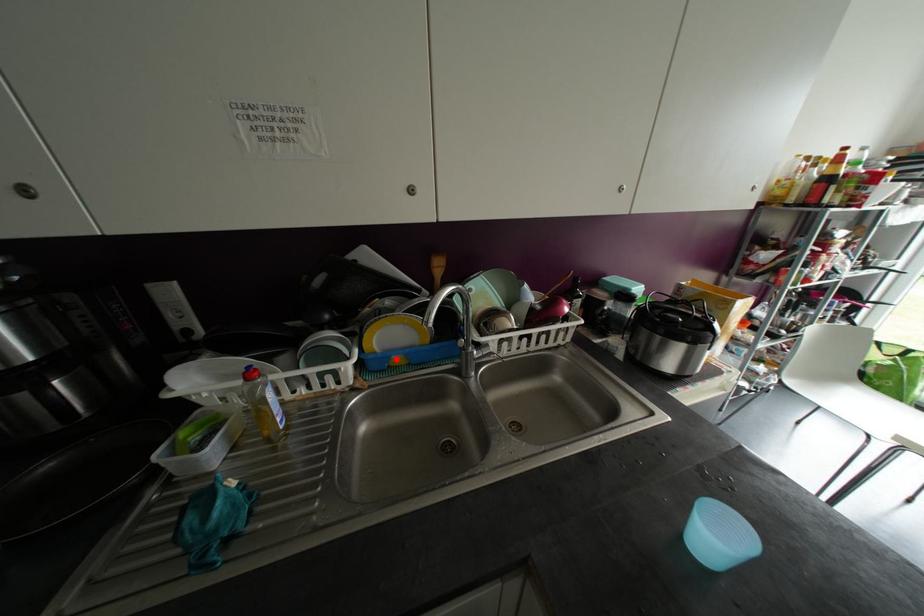
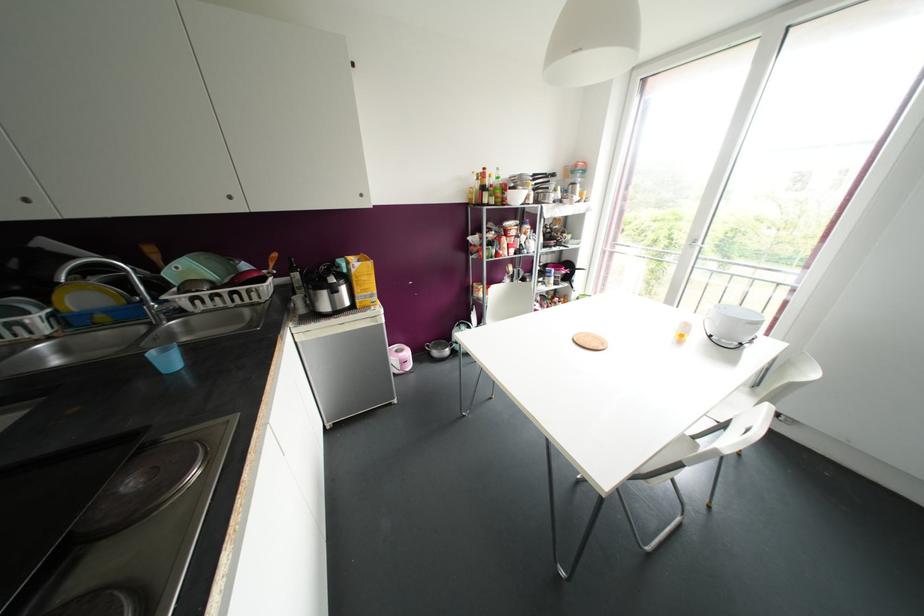
In the second image, find the point that corresponds to the highlighted location in the first image.

(101, 317)